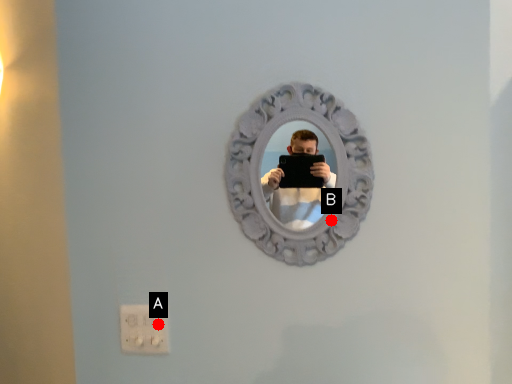
Question: Two points are circled on the image, labeled by A and B beside each circle. Which point is further to the camera?

Choices:
 (A) A is further
 (B) B is further

Answer: (A)